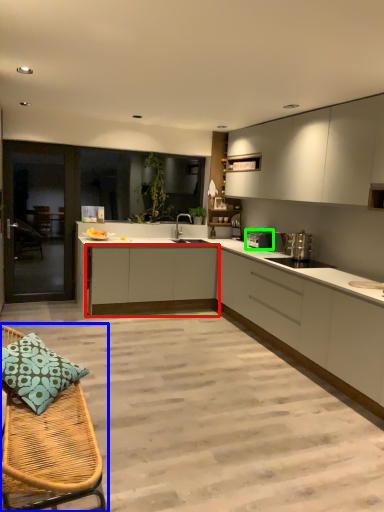
Question: Which is farther away from cabinetry (highlighted by a red box)? furniture (highlighted by a blue box) or appliance (highlighted by a green box)?

Choices:
 (A) furniture
 (B) appliance

Answer: (A)